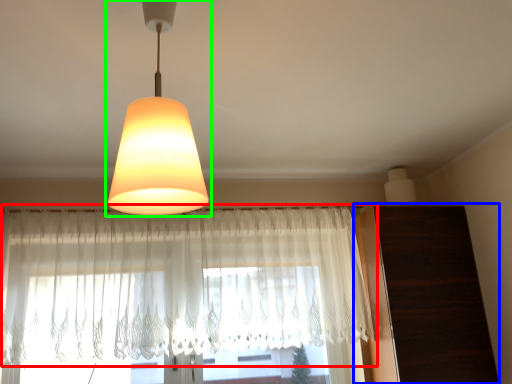
Question: Which object is positioned farthest from curtain (highlighted by a red box)? Select from dresser (highlighted by a blue box) and lamp (highlighted by a green box).

Choices:
 (A) dresser
 (B) lamp

Answer: (B)